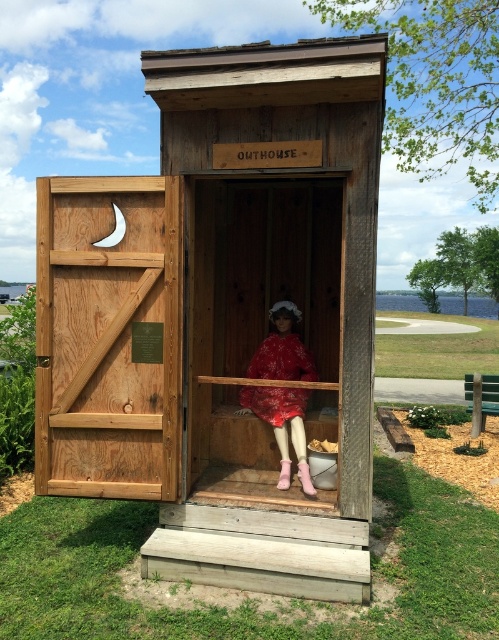
Question: Which point is farther to the camera?

Choices:
 (A) (201, 365)
 (B) (265, 392)

Answer: (B)

Question: Which point appears closest to the camera in this image?

Choices:
 (A) (179, 168)
 (B) (294, 362)

Answer: (A)

Question: Does wooden outhouse at center have a larger size compared to matte red dress at center?

Choices:
 (A) no
 (B) yes

Answer: (B)

Question: Which object is the farthest from the wooden outhouse at center?

Choices:
 (A) red velvet dress at center
 (B) matte red dress at center

Answer: (A)

Question: Where is wooden outhouse at center located in relation to matte red dress at center in the image?

Choices:
 (A) above
 (B) below

Answer: (A)

Question: In this image, where is wooden outhouse at center located relative to red velvet dress at center?

Choices:
 (A) right
 (B) left

Answer: (B)